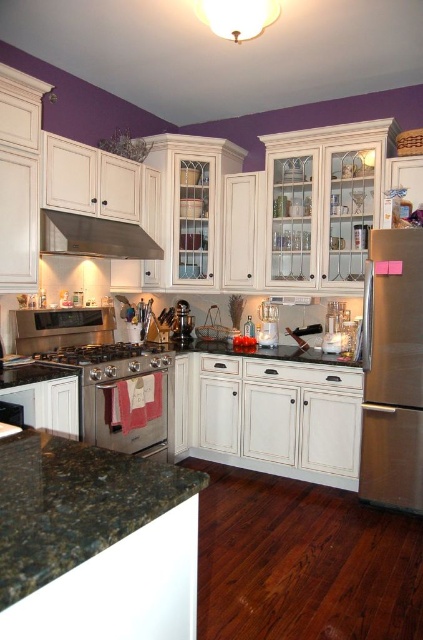
You are a chef preparing to cook a meal and need to know which appliance is shorter between the stainless steel stove at center and the brushed metal coffee pot at center. Can you tell me which one is shorter?

The stainless steel stove at center is not as tall as the brushed metal coffee pot at center, so the stainless steel stove at center is shorter.

You are a delivery person who needs to place a new microwave on the kitchen counter. The microwave must be placed exactly at the coordinates given for the stainless steel stove at center. Is there enough space on the counter to place the microwave there?

The stainless steel stove at center is located at coordinates point (98, 353). Since the stove is already occupying that exact point, there is no space to place the microwave there.